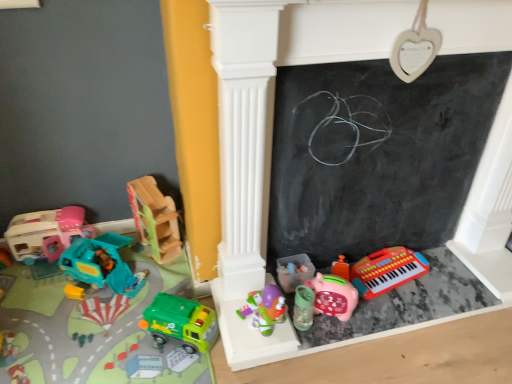
Image resolution: width=512 pixels, height=384 pixels. Find the location of `vacant region above pink plastic keyboard at lower right (from a real-world perspective)`. vacant region above pink plastic keyboard at lower right (from a real-world perspective) is located at coordinates (410, 297).